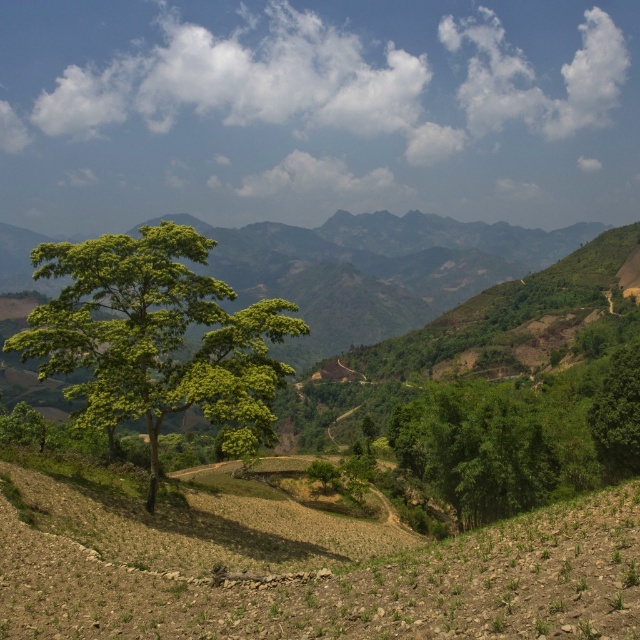
Question: Which point is farther to the camera?

Choices:
 (A) green leafy tree at center
 (B) green leafy tree at right

Answer: (B)

Question: Does green leafy tree at center have a lesser width compared to green leafy tree at right?

Choices:
 (A) yes
 (B) no

Answer: (A)

Question: Can you confirm if green leafy tree at center is positioned above green leafy tree at right?

Choices:
 (A) no
 (B) yes

Answer: (B)

Question: Can you confirm if green leafy tree at center is positioned above green leafy tree at right?

Choices:
 (A) no
 (B) yes

Answer: (B)

Question: Among these points, which one is nearest to the camera?

Choices:
 (A) (596, 432)
 (B) (108, 314)

Answer: (B)

Question: Among these points, which one is farthest from the camera?

Choices:
 (A) (64, 358)
 (B) (404, 428)

Answer: (B)